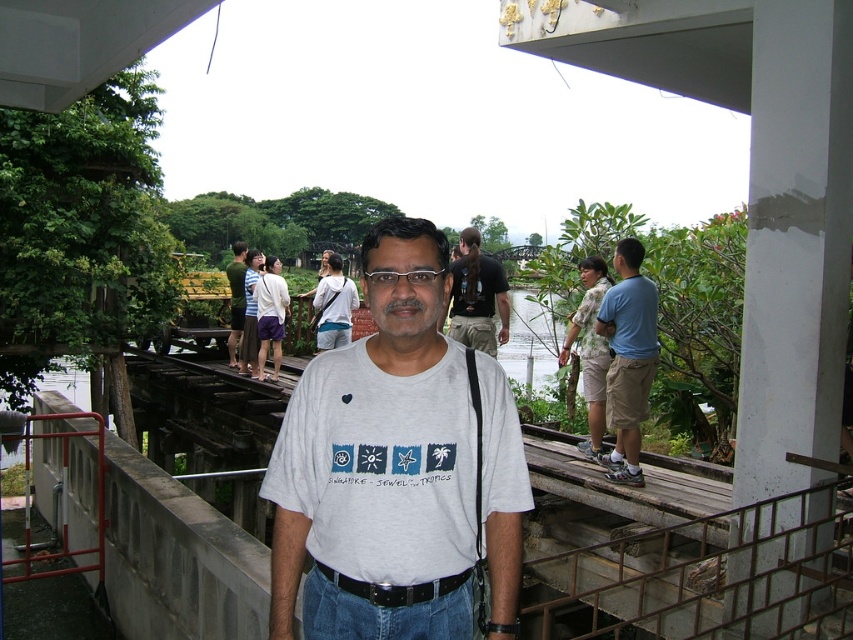
Question: Which point is closer to the camera?

Choices:
 (A) concrete railing at center
 (B) dark gray t-shirt at center

Answer: (A)

Question: Which object is closer to the camera taking this photo?

Choices:
 (A) blue cotton shirt at center
 (B) green water at center
 (C) green fabric shirt at center

Answer: (A)

Question: Does dark gray t-shirt at center appear on the right side of black leather belt at center?

Choices:
 (A) no
 (B) yes

Answer: (B)

Question: Is blue cotton shirt at center positioned in front of green water at center?

Choices:
 (A) no
 (B) yes

Answer: (B)

Question: Is blue cotton shirt at center bigger than green water at center?

Choices:
 (A) no
 (B) yes

Answer: (A)

Question: Which point appears farthest from the camera in this image?

Choices:
 (A) (636, 328)
 (B) (512, 371)
 (C) (703, 529)
 (D) (242, 244)

Answer: (B)